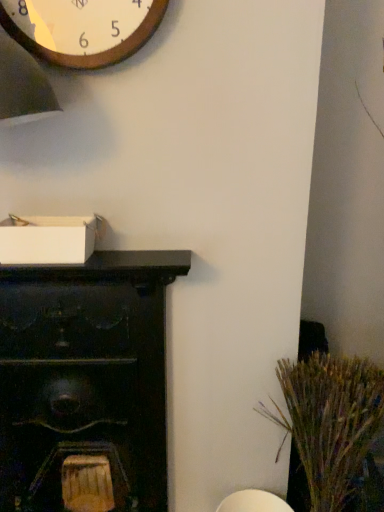
Question: Considering the relative positions of dry grass at right and dark wood cabinet at left in the image provided, is dry grass at right to the right of dark wood cabinet at left from the viewer's perspective?

Choices:
 (A) yes
 (B) no

Answer: (A)

Question: Are dry grass at right and dark wood cabinet at left located far from each other?

Choices:
 (A) yes
 (B) no

Answer: (B)

Question: From the image's perspective, is dry grass at right over dark wood cabinet at left?

Choices:
 (A) no
 (B) yes

Answer: (A)

Question: Can you confirm if dry grass at right is taller than dark wood cabinet at left?

Choices:
 (A) yes
 (B) no

Answer: (B)

Question: Could dark wood cabinet at left be considered to be inside dry grass at right?

Choices:
 (A) yes
 (B) no

Answer: (B)

Question: Is point (112, 294) positioned closer to the camera than point (66, 34)?

Choices:
 (A) farther
 (B) closer

Answer: (A)

Question: Considering the positions of dark wood cabinet at left and wooden wall clock at upper left in the image, is dark wood cabinet at left taller or shorter than wooden wall clock at upper left?

Choices:
 (A) tall
 (B) short

Answer: (A)

Question: Is dark wood cabinet at left bigger or smaller than wooden wall clock at upper left?

Choices:
 (A) small
 (B) big

Answer: (B)

Question: From a real-world perspective, relative to wooden wall clock at upper left, is dark wood cabinet at left vertically above or below?

Choices:
 (A) above
 (B) below

Answer: (B)

Question: Is dark wood cabinet at left wider or thinner than dry grass at right?

Choices:
 (A) thin
 (B) wide

Answer: (A)

Question: Is dark wood cabinet at left in front of or behind dry grass at right in the image?

Choices:
 (A) behind
 (B) front

Answer: (A)

Question: Based on their sizes in the image, would you say dark wood cabinet at left is bigger or smaller than dry grass at right?

Choices:
 (A) big
 (B) small

Answer: (A)

Question: From a real-world perspective, is dark wood cabinet at left positioned above or below dry grass at right?

Choices:
 (A) above
 (B) below

Answer: (A)

Question: Does point (327, 424) appear closer or farther from the camera than point (61, 48)?

Choices:
 (A) closer
 (B) farther

Answer: (B)

Question: Considering the positions of dry grass at right and wooden wall clock at upper left in the image, is dry grass at right taller or shorter than wooden wall clock at upper left?

Choices:
 (A) tall
 (B) short

Answer: (A)